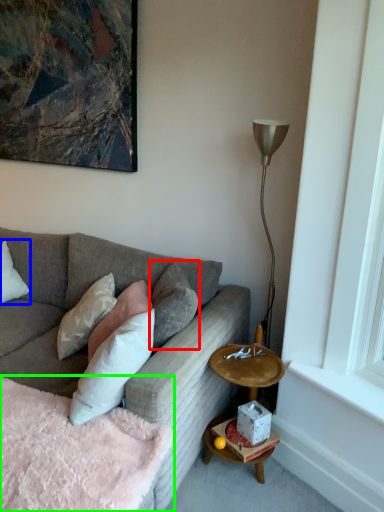
Question: Estimate the real-world distances between objects in this image. Which object is closer to pillow (highlighted by a red box), pillow (highlighted by a blue box) or bedding (highlighted by a green box)?

Choices:
 (A) pillow
 (B) bedding

Answer: (B)